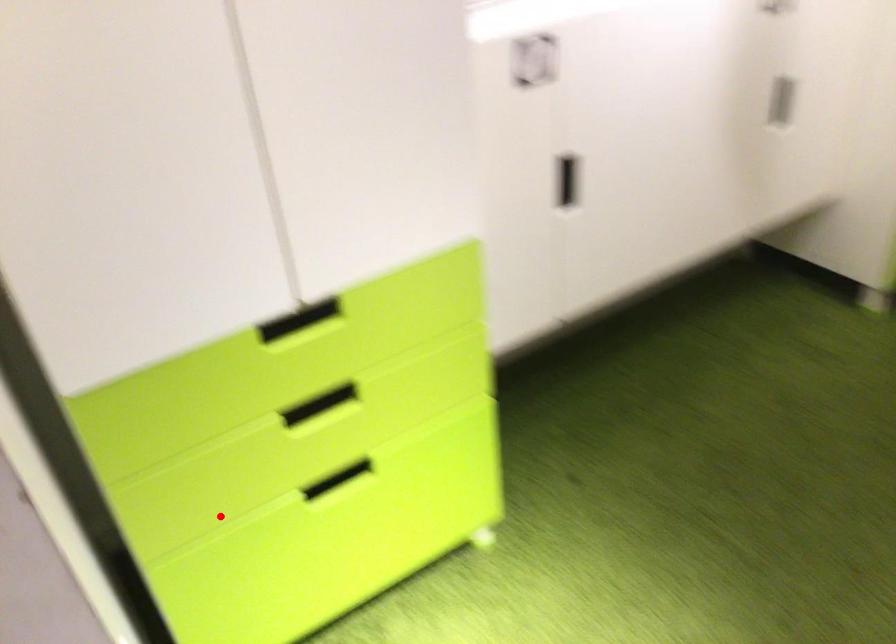
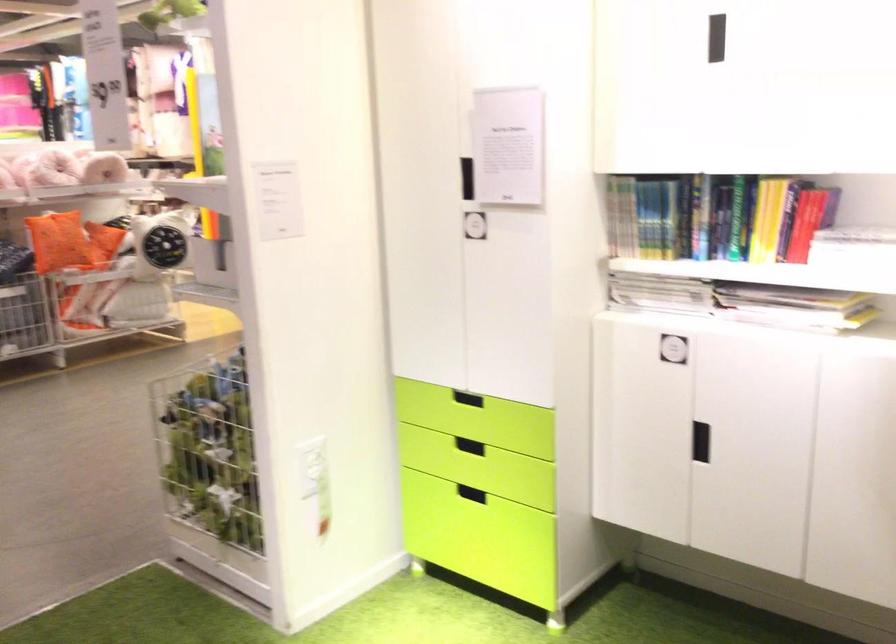
Question: I am providing you with two images of the same scene from different viewpoints. In image1, a red point is highlighted. Considering the same 3D point in image2, which of the following is correct?

Choices:
 (A) It is closer
 (B) It is farther

Answer: (B)